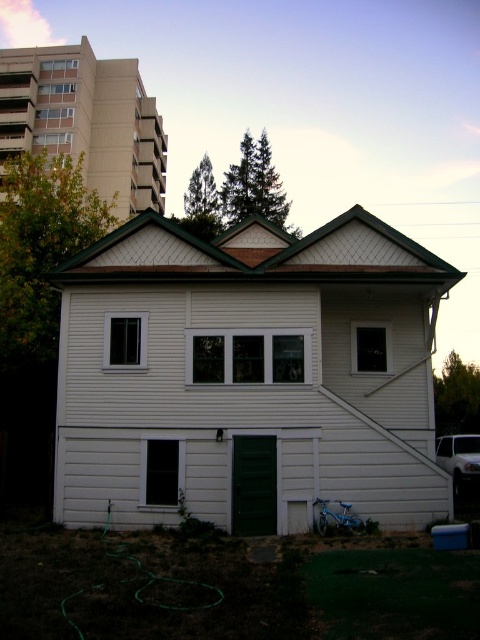
You are standing in front of the house and notice the green grass at lower left and the white siding shed at upper left. Based on their positions, which object is located to the right of the other?

The green grass at lower left is to the right of the white siding shed at upper left.

Based on the photo, you are standing in front of the house and want to move the blue bicycle from its current position to the white woodshed at center. Which direction should you move it so it doesn not block the path to the white siding shed at upper left?

The white woodshed at center is in front of the white siding shed at upper left. To avoid blocking the path to the white siding shed at upper left, you should move the blue bicycle to the side of the white woodshed at center instead of directly in front of it.

You are standing in front of the house and need to locate both the white woodshed at center and the white siding shed at upper left. Based on their positions, which one is closer to the ground?

The white woodshed at center is below the white siding shed at upper left, so it is closer to the ground.